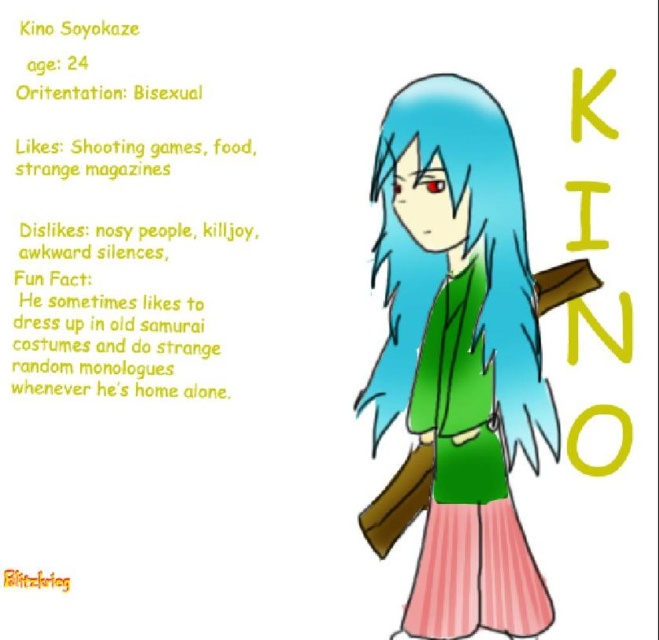
Question: Which point is farther to the camera?

Choices:
 (A) (47, 576)
 (B) (161, 170)

Answer: (B)

Question: Which point is closer to the camera?

Choices:
 (A) green fabric jacket at center
 (B) matte green dress at center
 (C) brushed metal blitzkrieg at lower left

Answer: (B)

Question: Is matte green dress at center to the right of green fabric jacket at center from the viewer's perspective?

Choices:
 (A) yes
 (B) no

Answer: (A)

Question: Is matte green dress at center above brushed metal blitzkrieg at lower left?

Choices:
 (A) yes
 (B) no

Answer: (A)

Question: Can you confirm if matte green dress at center is thinner than green fabric jacket at center?

Choices:
 (A) yes
 (B) no

Answer: (A)

Question: Based on their relative distances, which object is nearer to the green fabric jacket at center?

Choices:
 (A) matte green dress at center
 (B) brushed metal blitzkrieg at lower left

Answer: (A)